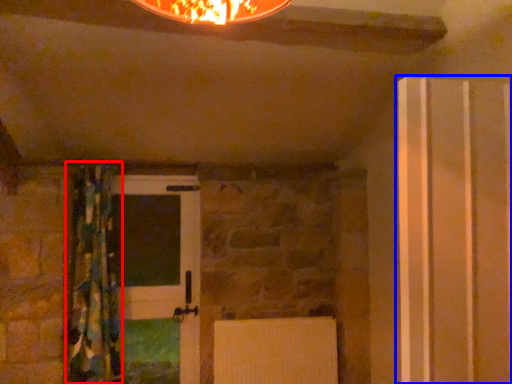
Question: Which point is closer to the camera, curtain (highlighted by a red box) or door (highlighted by a blue box)?

Choices:
 (A) curtain
 (B) door

Answer: (B)